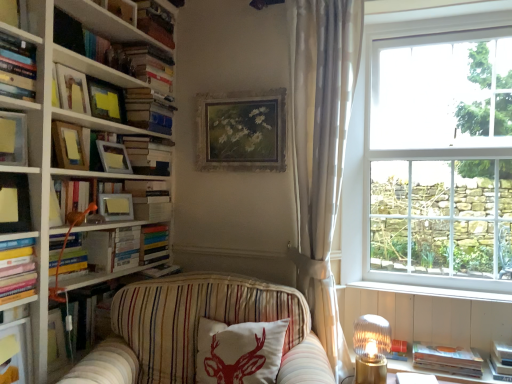
Measure the distance between point (421, 344) and camera.

Point (421, 344) and camera are 7.22 feet apart from each other.

What is the approximate height of matte silver picture frame at upper left, the 4th picture frame when ordered from left to right?

It is 6.98 inches.

At what (x,y) coordinates should I click in order to perform the action: click on hardcover book at upper center, arranged as the thirteenth book when ordered from the bottom. Please return your answer as a coordinate pair (x, y). The height and width of the screenshot is (384, 512). Looking at the image, I should click on (155, 22).

Describe the element at coordinates (149, 199) in the screenshot. This screenshot has height=384, width=512. I see `hardcover book at upper left, arranged as the ninth book when viewed from the top` at that location.

This screenshot has width=512, height=384. In order to click on matte yellow book at left, which is counted as the tenth book, starting from the top in this screenshot , I will do `click(17, 272)`.

Measure the distance between matte yellow picture frame at upper left, which is counted as the third picture frame, starting from the left, and camera.

The distance of matte yellow picture frame at upper left, which is counted as the third picture frame, starting from the left, from camera is 6.66 feet.

Locate an element on the screen. hardcover book at lower right, the 13th book viewed from the top is located at coordinates (447, 359).

Considering the sizes of objects white glossy bookcase at left and hardcover book at upper left, positioned as the 2th book in top-to-bottom order, in the image provided, who is taller, white glossy bookcase at left or hardcover book at upper left, positioned as the 2th book in top-to-bottom order,?

With more height is white glossy bookcase at left.

Is the position of white glossy bookcase at left more distant than that of hardcover book at upper left, positioned as the 2th book in top-to-bottom order?

No, it is not.

Which of these two, white glossy bookcase at left or hardcover book at upper left, positioned as the 2th book in top-to-bottom order, is bigger?

Bigger between the two is white glossy bookcase at left.

Would you say matte yellow book at left, the eighth book from the bottom, is part of matte white picture frame at upper left, marked as the 2th picture frame in a right-to-left arrangement,'s contents?

No, matte white picture frame at upper left, marked as the 2th picture frame in a right-to-left arrangement, does not contain matte yellow book at left, the eighth book from the bottom.

Does matte white picture frame at upper left, arranged as the 5th picture frame when viewed from the left, appear on the right side of matte yellow book at left, the eighth book from the bottom?

Yes.

Considering the relative sizes of matte white picture frame at upper left, arranged as the 5th picture frame when viewed from the left, and matte yellow book at left, the sixth book when ordered from top to bottom, in the image provided, is matte white picture frame at upper left, arranged as the 5th picture frame when viewed from the left, shorter than matte yellow book at left, the sixth book when ordered from top to bottom,?

Correct, matte white picture frame at upper left, arranged as the 5th picture frame when viewed from the left, is not as tall as matte yellow book at left, the sixth book when ordered from top to bottom.

Could you tell me if matte white picture frame at upper left, marked as the 2th picture frame in a right-to-left arrangement, is facing matte yellow book at left, the eighth book from the bottom?

No, matte white picture frame at upper left, marked as the 2th picture frame in a right-to-left arrangement, is not oriented towards matte yellow book at left, the eighth book from the bottom.

From the image's perspective, is white cotton cushion with red deer print at center on white glossy bookcase at left?

No.

Looking at their sizes, would you say white cotton cushion with red deer print at center is wider or thinner than white glossy bookcase at left?

Considering their sizes, white cotton cushion with red deer print at center looks slimmer than white glossy bookcase at left.

Is white cotton cushion with red deer print at center not near white glossy bookcase at left?

No, white cotton cushion with red deer print at center is not far away from white glossy bookcase at left.

From a real-world perspective, between hardcover book at upper left, arranged as the ninth book when viewed from the top, and white sheer curtain at right, who is vertically lower?

In real-world perspective, hardcover book at upper left, arranged as the ninth book when viewed from the top, is lower.

From the image's perspective, is hardcover book at upper left, which is the 5th book from bottom to top, above white sheer curtain at right?

No, from the image's perspective, hardcover book at upper left, which is the 5th book from bottom to top, is not over white sheer curtain at right.

Is hardcover book at upper left, arranged as the ninth book when viewed from the top, not close to white sheer curtain at right?

hardcover book at upper left, arranged as the ninth book when viewed from the top, is near white sheer curtain at right, not far away.

Considering the positions of points (143, 184) and (347, 63), is point (143, 184) farther from camera compared to point (347, 63)?

That is True.

Can we say matte yellow book at left, which is counted as the 7th book, starting from the top, lies outside white sheer curtain at right?

Absolutely, matte yellow book at left, which is counted as the 7th book, starting from the top, is external to white sheer curtain at right.

Can you confirm if matte yellow book at left, positioned as the seventh book in bottom-to-top order, is positioned to the right of white sheer curtain at right?

No, matte yellow book at left, positioned as the seventh book in bottom-to-top order, is not to the right of white sheer curtain at right.

Can you tell me how much matte yellow book at left, positioned as the seventh book in bottom-to-top order, and white sheer curtain at right differ in facing direction?

They differ by 71.9 degrees in their facing directions.

Which is behind, matte yellow picture frame at upper left, which is counted as the third picture frame, starting from the left, or matte yellow book at left, positioned as the seventh book in bottom-to-top order?

matte yellow picture frame at upper left, which is counted as the third picture frame, starting from the left, is further from the camera.

Is matte yellow picture frame at upper left, which is counted as the third picture frame, starting from the left, wider than matte yellow book at left, which is counted as the 7th book, starting from the top?

Yes, matte yellow picture frame at upper left, which is counted as the third picture frame, starting from the left, is wider than matte yellow book at left, which is counted as the 7th book, starting from the top.

Can you tell me how much matte yellow picture frame at upper left, arranged as the fourth picture frame when viewed from the right, and matte yellow book at left, positioned as the seventh book in bottom-to-top order, differ in facing direction?

20.1 degrees.

The image size is (512, 384). There is a white wood at lower right. What are the coordinates of `the 4th picture frame above it (from the image's perspective)` in the screenshot? It's located at (241, 131).

Who is smaller, gold-framed floral painting at upper center, which is counted as the first picture frame, starting from the right, or white wood at lower right?

white wood at lower right.

From a real-world perspective, is gold-framed floral painting at upper center, which ranks as the sixth picture frame in left-to-right order, positioned under white wood at lower right based on gravity?

No, from a real-world perspective, gold-framed floral painting at upper center, which ranks as the sixth picture frame in left-to-right order, is not beneath white wood at lower right.

From the picture: In the image, is gold-framed floral painting at upper center, which ranks as the sixth picture frame in left-to-right order, positioned in front of or behind white wood at lower right?

gold-framed floral painting at upper center, which ranks as the sixth picture frame in left-to-right order, is positioned farther from the viewer than white wood at lower right.

Locate an element on the screen. This screenshot has height=384, width=512. bookcase on the left side of hardcover book at upper left, positioned as the 12th book in bottom-to-top order is located at coordinates (52, 143).

From a real-world perspective, starting from the matte yellow book at left, the sixth book when ordered from top to bottom, which picture frame is the 1st one below it? Please provide its 2D coordinates.

[(114, 157)]

Based on their spatial positions, is striped fabric couch at center or hardcover book at upper center, acting as the 1th book starting from the top, further from matte yellow book at left, the sixth book when ordered from top to bottom?

Based on the image, hardcover book at upper center, acting as the 1th book starting from the top, appears to be further to matte yellow book at left, the sixth book when ordered from top to bottom.

When comparing their distances from hardcover book at upper left, which is counted as the eleventh book, starting from the bottom, does matte white shelf at lower left or matte yellow book at left, which is counted as the tenth book, starting from the top, seem further?

matte white shelf at lower left is further to hardcover book at upper left, which is counted as the eleventh book, starting from the bottom.

Based on their spatial positions, is white wood at lower right or white sheer curtain at right closer to matte yellow book at left, the eighth book from the bottom?

white sheer curtain at right is positioned closer to the anchor matte yellow book at left, the eighth book from the bottom.

Based on the photo, estimate the real-world distances between objects in this image. Which object is closer to matte yellow book at left, the eighth book from the bottom, hardcover book at upper left, which is counted as the eleventh book, starting from the bottom, or hardcover book at upper left, which is the 5th book from bottom to top?

Among the two, hardcover book at upper left, which is counted as the eleventh book, starting from the bottom, is located nearer to matte yellow book at left, the eighth book from the bottom.

Considering their positions, is hardcover books at upper left, which is counted as the tenth book, starting from the bottom, positioned closer to white sheer curtain at right than striped fabric couch at center?

Based on the image, striped fabric couch at center appears to be nearer to white sheer curtain at right.

Estimate the real-world distances between objects in this image. Which object is closer to matte yellow book at left, the sixth book when ordered from top to bottom, matte yellow book at left, positioned as the seventh book in bottom-to-top order, or hardcover book at lower right, positioned as the 1th book in bottom-to-top order?

matte yellow book at left, positioned as the seventh book in bottom-to-top order.

Based on their spatial positions, is white cotton cushion with red deer print at center or clear glass window at upper right closer to matte white picture frame at upper left, arranged as the 5th picture frame when viewed from the left?

white cotton cushion with red deer print at center.

From the image, which object appears to be farther from matte yellow book at left, the sixth book when ordered from top to bottom, hardcover book at upper left, arranged as the ninth book when viewed from the top, or gold-framed floral painting at upper center, which ranks as the sixth picture frame in left-to-right order?

Based on the image, gold-framed floral painting at upper center, which ranks as the sixth picture frame in left-to-right order, appears to be further to matte yellow book at left, the sixth book when ordered from top to bottom.

Locate an element on the screen. throw pillow between matte white picture frame at upper left, arranged as the 5th picture frame when viewed from the left, and striped fabric couch at center from top to bottom is located at coordinates (239, 352).

The width and height of the screenshot is (512, 384). Find the location of `window sill between hardcover book at upper center, arranged as the thirteenth book when ordered from the bottom, and hardcover book at lower right, which appears as the 2th book when ordered from the bottom, in the horizontal direction`. window sill between hardcover book at upper center, arranged as the thirteenth book when ordered from the bottom, and hardcover book at lower right, which appears as the 2th book when ordered from the bottom, in the horizontal direction is located at coordinates (432, 291).

Locate an element on the screen. The height and width of the screenshot is (384, 512). window sill between orange fabric lamp at left, marked as the first lamp in a front-to-back arrangement, and hardcover book at lower right, positioned as the 1th book in bottom-to-top order is located at coordinates (432, 291).

What are the coordinates of `bookcase situated between matte yellow book at left, the eighth book from the bottom, and hardcover book at lower right, the 13th book viewed from the top, from left to right` in the screenshot? It's located at pyautogui.click(x=52, y=143).